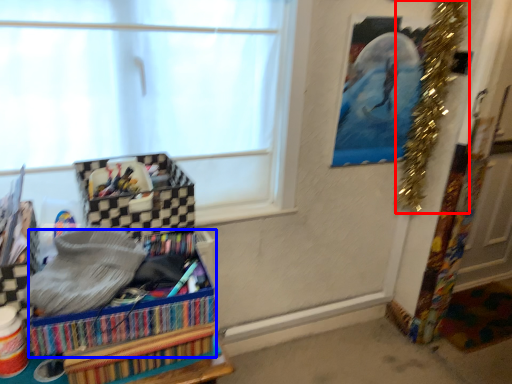
Question: Which object is closer to the camera taking this photo, christmas decoration (highlighted by a red box) or storage box (highlighted by a blue box)?

Choices:
 (A) christmas decoration
 (B) storage box

Answer: (B)